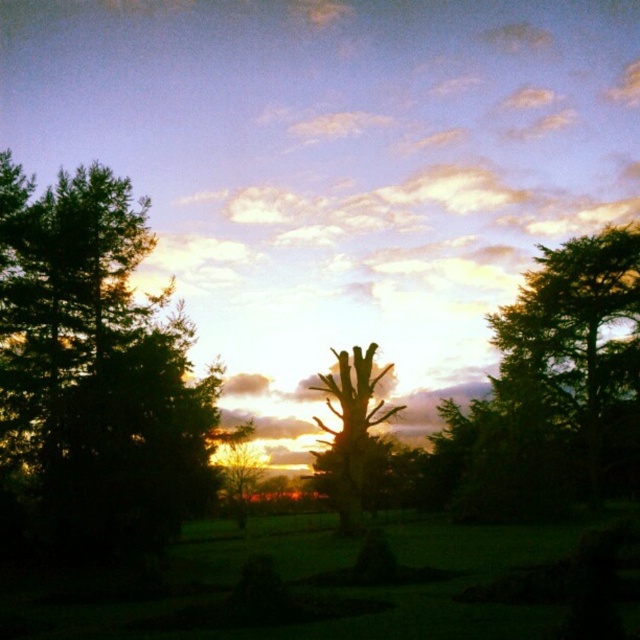
Based on the photo, you are an artist sketching this sunset scene. You want to draw the silhouette wood tree at center and the white fluffy cloud at upper center accurately. Which object should you draw first to ensure proper layering?

You should draw the white fluffy cloud at upper center first because the silhouette wood tree at center is behind it, so placing the cloud over the tree would cover part of it and disrupt the layering. By drawing the cloud last, you can ensure the tree remains visible beneath.

You are an artist trying to sketch this sunset scene. You notice the white fluffy cloud at upper center and the silhouette wood tree at center. Which object should you draw first if you want to follow the rule of drawing larger objects before smaller ones?

The white fluffy cloud at upper center is larger than the silhouette wood tree at center, so you should draw the white fluffy cloud at upper center first.

You are an artist sketching the sunset scene. You notice the white fluffy cloud at upper center and the silhouette wood tree at center. Which object is located to the right of the other?

The white fluffy cloud at upper center is positioned on the right side of silhouette wood tree at center.